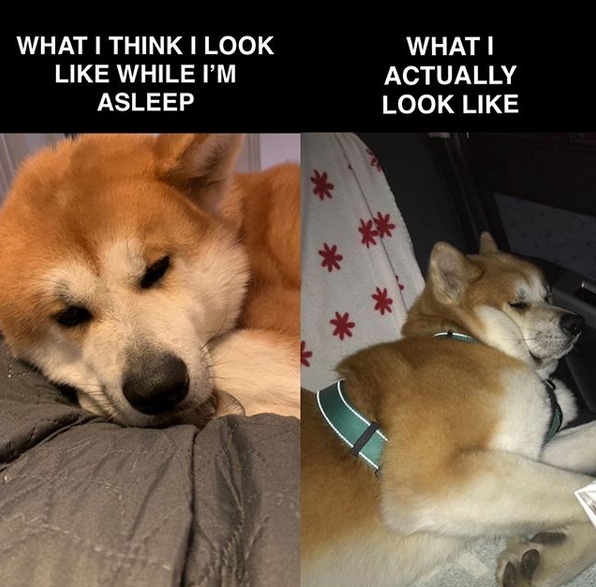
Where is `door`? The image size is (596, 587). door is located at coordinates (20, 141).